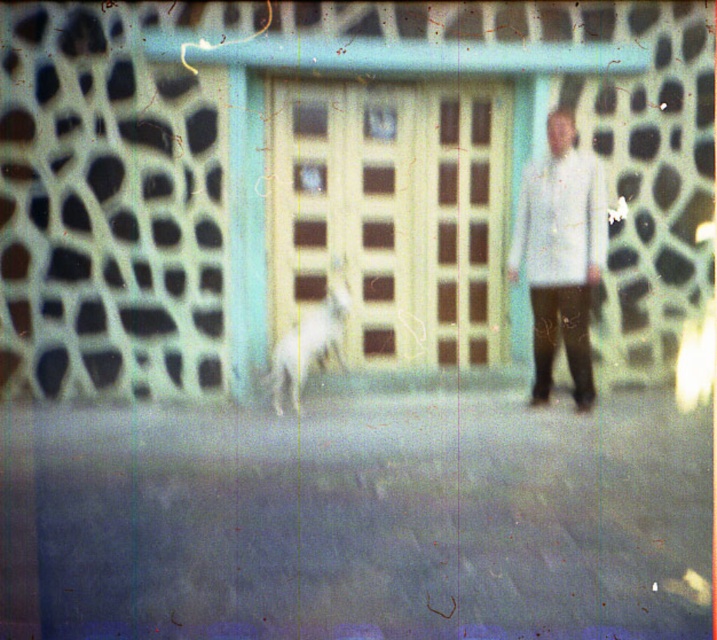
You are a photographer trying to capture a clear shot of both the white matte shirt at center and the white fur dog at center. Since both are white, you need to adjust your camera settings to ensure proper exposure. Which object should you focus on first to balance the exposure, considering their sizes?

The white matte shirt at center is larger in size than the white fur dog at center, so focusing on the larger white matte shirt at center first would help balance the exposure as it occupies more of the frame.

You are a photographer trying to capture a clear photo of the white fur dog at center without the white matte shirt at center blocking it. Based on their positions, which object should you focus on to ensure the dog is visible?

The white matte shirt at center is positioned on the right side of white fur dog at center, so focusing on the left side of the white fur dog at center will ensure it is visible without obstruction.

You are a painter who needs to decide which object to paint first. Since you want to paint the larger object first, which one should you choose between the yellow matte door at center and the white matte shirt at center?

The yellow matte door at center has a larger size compared to the white matte shirt at center, so you should paint the yellow matte door at center first.